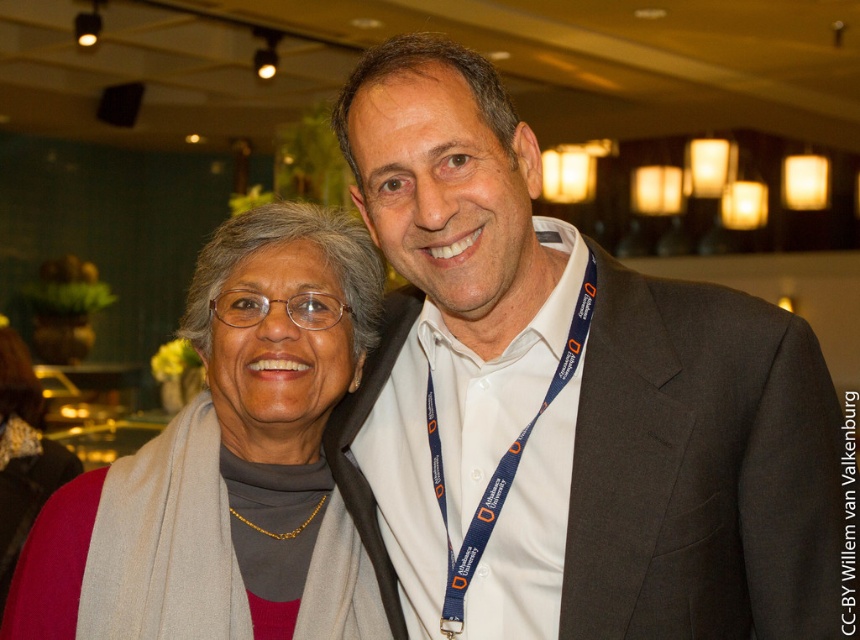
Who is more forward, (434,358) or (588,298)?

Point (588,298) is in front.

What do you see at coordinates (567, 401) in the screenshot? This screenshot has width=860, height=640. I see `white shirt at center` at bounding box center [567, 401].

In order to click on white shirt at center in this screenshot , I will do `click(567, 401)`.

Between point (75, 595) and point (441, 467), which one is positioned in front?

Point (75, 595)

What do you see at coordinates (280, 385) in the screenshot?
I see `matte gray scarf at left` at bounding box center [280, 385].

Find the location of a particular element. This screenshot has width=860, height=640. matte gray scarf at left is located at coordinates (280, 385).

Who is more forward, (389, 538) or (102, 496)?

Point (102, 496) is in front.

Which of these two, white shirt at center or matte gray scarf at left, stands shorter?

With less height is matte gray scarf at left.

The height and width of the screenshot is (640, 860). What do you see at coordinates (567, 401) in the screenshot?
I see `white shirt at center` at bounding box center [567, 401].

What are the coordinates of `white shirt at center` in the screenshot? It's located at (567, 401).